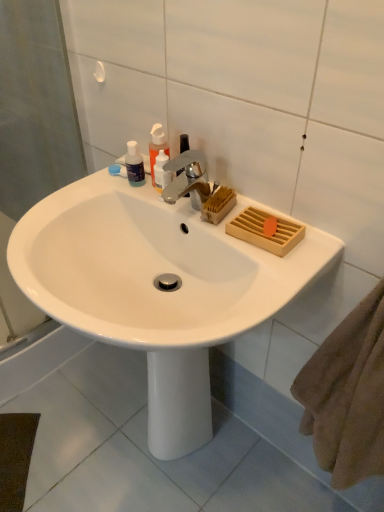
Question: Are white glossy sink at center and translucent plastic bottle at upper left, the 2th toiletry from the right, located far from each other?

Choices:
 (A) no
 (B) yes

Answer: (A)

Question: From the image's perspective, is white glossy sink at center beneath translucent plastic bottle at upper left, the 1th toiletry viewed from the left?

Choices:
 (A) no
 (B) yes

Answer: (B)

Question: Is white glossy sink at center looking in the opposite direction of translucent plastic bottle at upper left, the 2th toiletry from the right?

Choices:
 (A) no
 (B) yes

Answer: (A)

Question: Is white glossy sink at center further to camera compared to translucent plastic bottle at upper left, the 1th toiletry viewed from the left?

Choices:
 (A) no
 (B) yes

Answer: (A)

Question: Considering the relative sizes of white glossy sink at center and translucent plastic bottle at upper left, the 2th toiletry from the right, in the image provided, is white glossy sink at center wider than translucent plastic bottle at upper left, the 2th toiletry from the right,?

Choices:
 (A) yes
 (B) no

Answer: (A)

Question: From the image's perspective, is translucent plastic bottle at upper left, the 2th toiletry from the right, positioned above or below translucent plastic soap dispenser at upper center?

Choices:
 (A) below
 (B) above

Answer: (A)

Question: Looking at the image, does translucent plastic bottle at upper left, the 2th toiletry from the right, seem bigger or smaller compared to translucent plastic soap dispenser at upper center?

Choices:
 (A) small
 (B) big

Answer: (A)

Question: In the image, is translucent plastic bottle at upper left, the 1th toiletry viewed from the left, positioned in front of or behind translucent plastic soap dispenser at upper center?

Choices:
 (A) front
 (B) behind

Answer: (B)

Question: From a real-world perspective, is translucent plastic bottle at upper left, the 2th toiletry from the right, above or below translucent plastic soap dispenser at upper center?

Choices:
 (A) below
 (B) above

Answer: (A)

Question: Is translucent plastic soap dispenser at upper center wider or thinner than translucent plastic bottles at upper left, the first toiletry when ordered from right to left?

Choices:
 (A) wide
 (B) thin

Answer: (A)

Question: In terms of size, does translucent plastic soap dispenser at upper center appear bigger or smaller than translucent plastic bottles at upper left, the first toiletry when ordered from right to left?

Choices:
 (A) small
 (B) big

Answer: (B)

Question: In the image, is translucent plastic soap dispenser at upper center on the left side or the right side of translucent plastic bottles at upper left, which ranks as the second toiletry in left-to-right order?

Choices:
 (A) left
 (B) right

Answer: (A)

Question: From the image's perspective, is translucent plastic soap dispenser at upper center positioned above or below translucent plastic bottles at upper left, which ranks as the second toiletry in left-to-right order?

Choices:
 (A) below
 (B) above

Answer: (B)

Question: Would you say translucent plastic bottles at upper left, the first toiletry when ordered from right to left, is to the left or to the right of translucent plastic soap dispenser at upper center in the picture?

Choices:
 (A) left
 (B) right

Answer: (B)

Question: Is translucent plastic bottles at upper left, which ranks as the second toiletry in left-to-right order, wider or thinner than translucent plastic soap dispenser at upper center?

Choices:
 (A) wide
 (B) thin

Answer: (B)